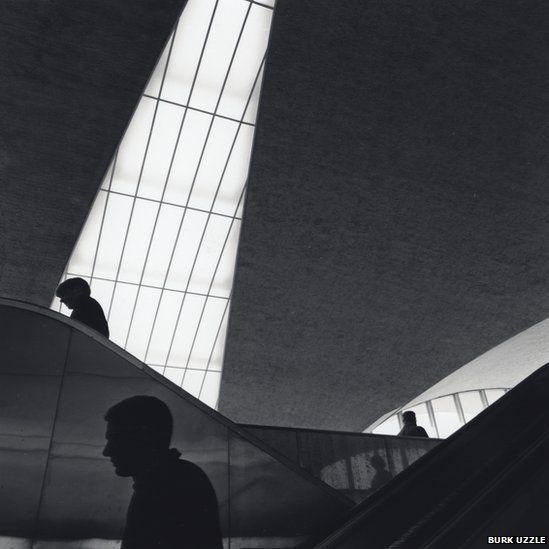
Locate an element on the screen. This screenshot has width=549, height=549. oval of light coming through wall panels is located at coordinates [338, 472], [363, 470], [399, 462], [413, 458].